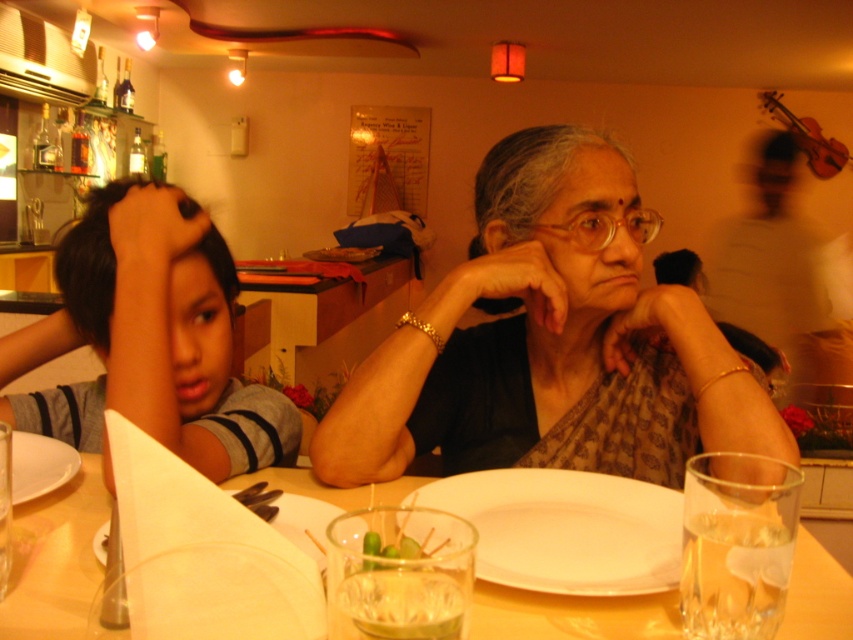
Is clear glass at lower center closer to camera compared to white matte plate at lower center?

That is True.

Is clear glass at lower center to the left of white matte plate at lower center from the viewer's perspective?

No, clear glass at lower center is not to the left of white matte plate at lower center.

Based on the photo, measure the distance between clear glass at lower center and camera.

clear glass at lower center and camera are 41.01 centimeters apart from each other.

Locate an element on the screen. clear glass at lower center is located at coordinates (398, 573).

Consider the image. Who is positioned more to the right, dark skin hand at left or gold metallic glasses at center?

From the viewer's perspective, gold metallic glasses at center appears more on the right side.

Is dark skin hand at left below gold metallic glasses at center?

Indeed, dark skin hand at left is positioned under gold metallic glasses at center.

Does point (180, 200) come farther from viewer compared to point (613, 218)?

No.

The image size is (853, 640). Find the location of `dark skin hand at left`. dark skin hand at left is located at coordinates (160, 218).

Can you confirm if translucent glass table at center is wider than white matte plate at lower left?

Yes, translucent glass table at center is wider than white matte plate at lower left.

Between point (91, 506) and point (30, 493), which one is positioned behind?

Positioned behind is point (91, 506).

This screenshot has height=640, width=853. What are the coordinates of `translucent glass table at center` in the screenshot? It's located at (55, 560).